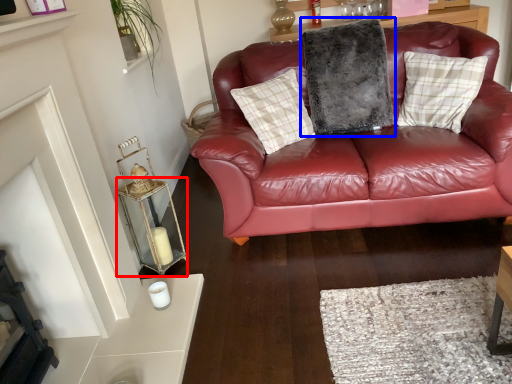
Question: Which object is further to the camera taking this photo, table (highlighted by a red box) or pillow (highlighted by a blue box)?

Choices:
 (A) table
 (B) pillow

Answer: (B)